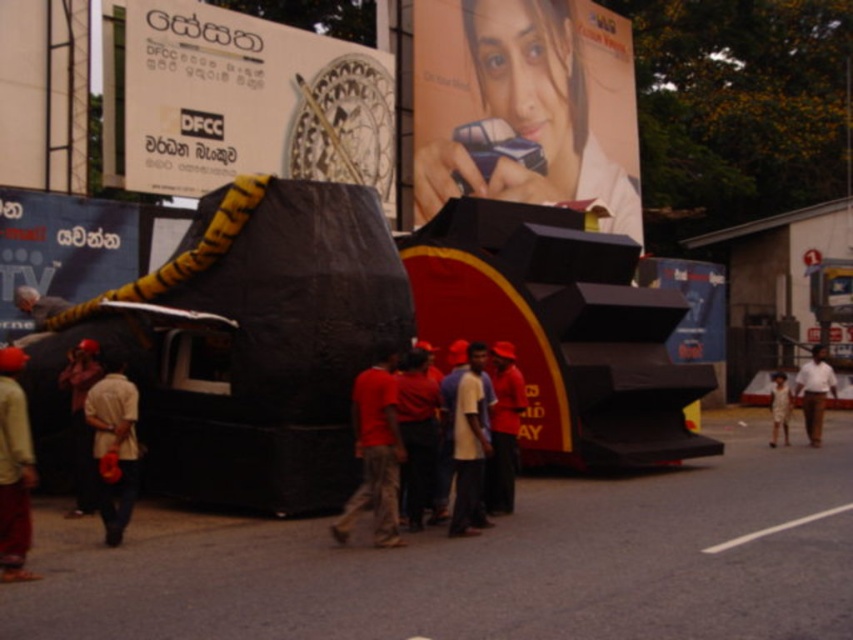
Question: Does matte black signboard at left have a larger size compared to dark brown leather jacket at lower left?

Choices:
 (A) yes
 (B) no

Answer: (A)

Question: Does yellow fabric shirt at lower left lie behind light beige fabric shirt at center?

Choices:
 (A) no
 (B) yes

Answer: (A)

Question: Is light beige fabric shirt at center thinner than dark brown leather jacket at lower left?

Choices:
 (A) yes
 (B) no

Answer: (A)

Question: Which point is farther to the camera?

Choices:
 (A) light beige fabric shirt at center
 (B) white cotton shirt at center
 (C) matte plastic phone at upper center
 (D) red matte shirt at center

Answer: (C)

Question: Among these points, which one is nearest to the camera?

Choices:
 (A) click(97, 461)
 (B) click(404, 515)
 (C) click(206, 109)
 (D) click(477, 412)

Answer: (D)

Question: Which of these objects is positioned closest to the matte black billboard at upper left?

Choices:
 (A) yellow fabric shirt at lower left
 (B) light beige fabric shirt at center
 (C) camouflage pants at center
 (D) matte black signboard at left

Answer: (D)